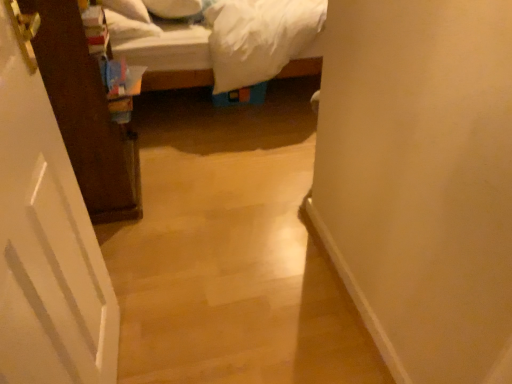
Measure the distance between point (21,99) and camera.

Point (21,99) and camera are 32.87 inches apart.

In order to click on white soft pillow at upper center, which appears as the first pillow when viewed from the right in this screenshot , I will do `click(174, 8)`.

Where is `pillow located in front of the white soft pillow at upper center, positioned as the 2th pillow in left-to-right order`? The image size is (512, 384). pillow located in front of the white soft pillow at upper center, positioned as the 2th pillow in left-to-right order is located at coordinates (128, 9).

Are white soft pillow at upper left, the 1th pillow positioned from the left, and white soft pillow at upper center, positioned as the 2th pillow in left-to-right order, beside each other?

They are not placed beside each other.

How many degrees apart are the facing directions of white soft pillow at upper left, the 1th pillow positioned from the left, and white soft pillow at upper center, positioned as the 2th pillow in left-to-right order?

The angular difference between white soft pillow at upper left, the 1th pillow positioned from the left, and white soft pillow at upper center, positioned as the 2th pillow in left-to-right order, is 9.43 degrees.

Which of these two, white soft pillow at upper left, which is the second pillow from right to left, or white soft pillow at upper center, positioned as the 2th pillow in left-to-right order, is wider?

white soft pillow at upper center, positioned as the 2th pillow in left-to-right order, is wider.

In the scene shown: Is white soft pillow at upper center, which appears as the first pillow when viewed from the right, shorter than white matte door at left?

Indeed, white soft pillow at upper center, which appears as the first pillow when viewed from the right, has a lesser height compared to white matte door at left.

Is white soft pillow at upper center, which appears as the first pillow when viewed from the right, oriented towards white matte door at left?

No, white soft pillow at upper center, which appears as the first pillow when viewed from the right, is not aimed at white matte door at left.

In the scene shown: Could you measure the distance between white soft pillow at upper center, positioned as the 2th pillow in left-to-right order, and white matte door at left?

A distance of 5.78 feet exists between white soft pillow at upper center, positioned as the 2th pillow in left-to-right order, and white matte door at left.

In the scene shown: Between white soft pillow at upper center, positioned as the 2th pillow in left-to-right order, and white matte door at left, which one has larger size?

With larger size is white matte door at left.

Would you say white matte door at left is to the left or to the right of white soft pillow at upper center, positioned as the 2th pillow in left-to-right order, in the picture?

white matte door at left is to the right of white soft pillow at upper center, positioned as the 2th pillow in left-to-right order.

Starting from the white matte door at left, which pillow is the 1st one to the left? Please provide its 2D coordinates.

[(174, 8)]

Does white matte door at left have a lesser width compared to white soft pillow at upper center, positioned as the 2th pillow in left-to-right order?

Indeed, white matte door at left has a lesser width compared to white soft pillow at upper center, positioned as the 2th pillow in left-to-right order.

How far apart are white matte door at left and white soft pillow at upper center, positioned as the 2th pillow in left-to-right order?

A distance of 1.76 meters exists between white matte door at left and white soft pillow at upper center, positioned as the 2th pillow in left-to-right order.

From the image's perspective, is white soft pillow at upper center, positioned as the 2th pillow in left-to-right order, located above or below white soft pillow at upper left, which is the second pillow from right to left?

From the image's perspective, white soft pillow at upper center, positioned as the 2th pillow in left-to-right order, appears above white soft pillow at upper left, which is the second pillow from right to left.

Could you tell me if white soft pillow at upper center, which appears as the first pillow when viewed from the right, is facing white soft pillow at upper left, the 1th pillow positioned from the left?

No, white soft pillow at upper center, which appears as the first pillow when viewed from the right, is not oriented towards white soft pillow at upper left, the 1th pillow positioned from the left.

Would you say white soft pillow at upper left, which is the second pillow from right to left, is part of white soft pillow at upper center, positioned as the 2th pillow in left-to-right order,'s contents?

That's incorrect, white soft pillow at upper left, which is the second pillow from right to left, is not inside white soft pillow at upper center, positioned as the 2th pillow in left-to-right order.

From a real-world perspective, which object stands above the other?

white soft pillow at upper left, the 1th pillow positioned from the left, from a real-world perspective.

Is white matte door at left positioned beyond the bounds of white soft pillow at upper left, the 1th pillow positioned from the left?

Yes, white matte door at left is located beyond the bounds of white soft pillow at upper left, the 1th pillow positioned from the left.

Consider the image. From the image's perspective, which is above, white matte door at left or white soft pillow at upper left, which is the second pillow from right to left?

white soft pillow at upper left, which is the second pillow from right to left, from the image's perspective.

Which object is positioned more to the right, white matte door at left or white soft pillow at upper left, the 1th pillow positioned from the left?

Positioned to the right is white matte door at left.

Is white soft pillow at upper left, the 1th pillow positioned from the left, far from white matte door at left?

Yes, white soft pillow at upper left, the 1th pillow positioned from the left, and white matte door at left are quite far apart.

Which is less distant, [139,6] or [81,239]?

Point [139,6] is positioned farther from the camera compared to point [81,239].

How far apart are white soft pillow at upper left, which is the second pillow from right to left, and white matte door at left?

white soft pillow at upper left, which is the second pillow from right to left, is 1.65 meters from white matte door at left.

Is white soft pillow at upper left, the 1th pillow positioned from the left, smaller than white matte door at left?

Yes.

Where is `pillow in front of the white soft pillow at upper center, which appears as the first pillow when viewed from the right`? The image size is (512, 384). pillow in front of the white soft pillow at upper center, which appears as the first pillow when viewed from the right is located at coordinates (128, 9).

You are a GUI agent. You are given a task and a screenshot of the screen. Output one action in this format:
    pyautogui.click(x=<x>, y=<y>)
    Task: Click on the pillow that is the 2nd object located behind the white matte door at left
    
    Given the screenshot: What is the action you would take?
    [x=174, y=8]

Considering their positions, is white matte door at left positioned closer to white soft pillow at upper center, positioned as the 2th pillow in left-to-right order, than white soft pillow at upper left, the 1th pillow positioned from the left?

white soft pillow at upper left, the 1th pillow positioned from the left.

Based on their spatial positions, is white soft pillow at upper left, the 1th pillow positioned from the left, or white soft pillow at upper center, which appears as the first pillow when viewed from the right, closer to white matte door at left?

white soft pillow at upper left, the 1th pillow positioned from the left, is closer to white matte door at left.

Looking at the image, which one is located further to white soft pillow at upper left, the 1th pillow positioned from the left, white soft pillow at upper center, which appears as the first pillow when viewed from the right, or white matte door at left?

white matte door at left.

Estimate the real-world distances between objects in this image. Which object is closer to white soft pillow at upper center, which appears as the first pillow when viewed from the right, white soft pillow at upper left, which is the second pillow from right to left, or white matte door at left?

Based on the image, white soft pillow at upper left, which is the second pillow from right to left, appears to be nearer to white soft pillow at upper center, which appears as the first pillow when viewed from the right.

Considering their positions, is white matte door at left positioned further to white soft pillow at upper left, which is the second pillow from right to left, than white soft pillow at upper center, positioned as the 2th pillow in left-to-right order?

Based on the image, white matte door at left appears to be further to white soft pillow at upper left, which is the second pillow from right to left.

From the image, which object appears to be nearer to white matte door at left, white soft pillow at upper center, positioned as the 2th pillow in left-to-right order, or white soft pillow at upper left, the 1th pillow positioned from the left?

The object closer to white matte door at left is white soft pillow at upper left, the 1th pillow positioned from the left.

You are a GUI agent. You are given a task and a screenshot of the screen. Output one action in this format:
    pyautogui.click(x=<x>, y=<y>)
    Task: Click on the pillow positioned between white matte door at left and white soft pillow at upper center, positioned as the 2th pillow in left-to-right order, from near to far
    This screenshot has width=512, height=384.
    Given the screenshot: What is the action you would take?
    pyautogui.click(x=128, y=9)